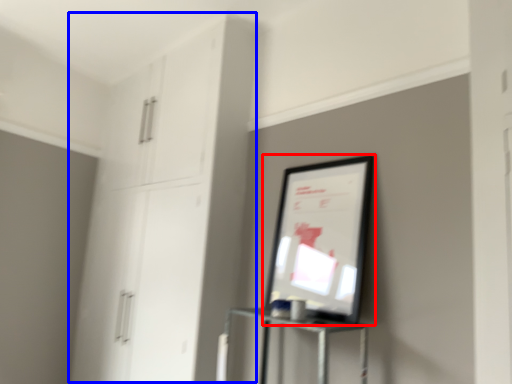
Question: Among these objects, which one is nearest to the camera, picture frame (highlighted by a red box) or dresser (highlighted by a blue box)?

Choices:
 (A) picture frame
 (B) dresser

Answer: (A)